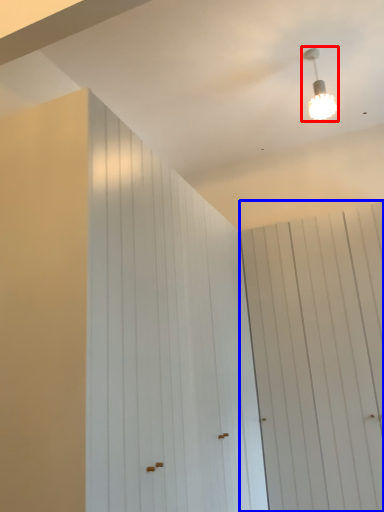
Question: Which object is further to the camera taking this photo, lamp (highlighted by a red box) or barn door (highlighted by a blue box)?

Choices:
 (A) lamp
 (B) barn door

Answer: (A)